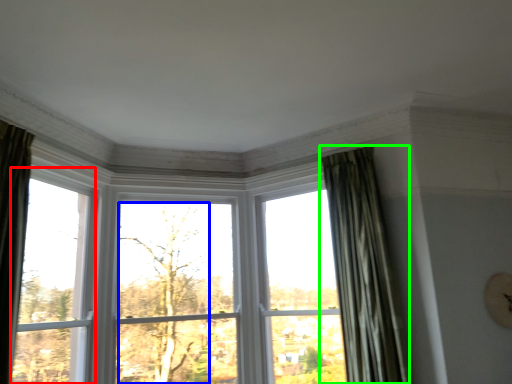
Question: Based on their relative distances, which object is farther from window (highlighted by a red box)? Choose from tree (highlighted by a blue box) and curtain (highlighted by a green box).

Choices:
 (A) tree
 (B) curtain

Answer: (B)